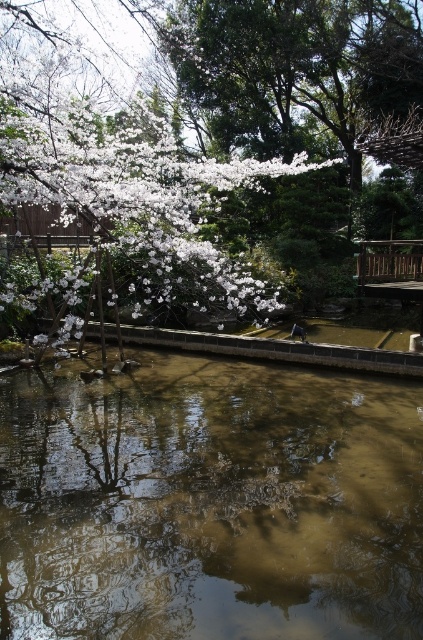
Question: Which point is closer to the camera taking this photo?

Choices:
 (A) (98, 461)
 (B) (150, 189)

Answer: (A)

Question: Can you confirm if brown reflective water at center is positioned to the left of white blossoms at upper left?

Choices:
 (A) no
 (B) yes

Answer: (A)

Question: Does brown reflective water at center lie in front of white blossoms at upper left?

Choices:
 (A) yes
 (B) no

Answer: (A)

Question: Which point is farther from the camera taking this photo?

Choices:
 (A) (398, 595)
 (B) (209, 164)

Answer: (B)

Question: Does brown reflective water at center have a larger size compared to white blossoms at upper left?

Choices:
 (A) no
 (B) yes

Answer: (A)